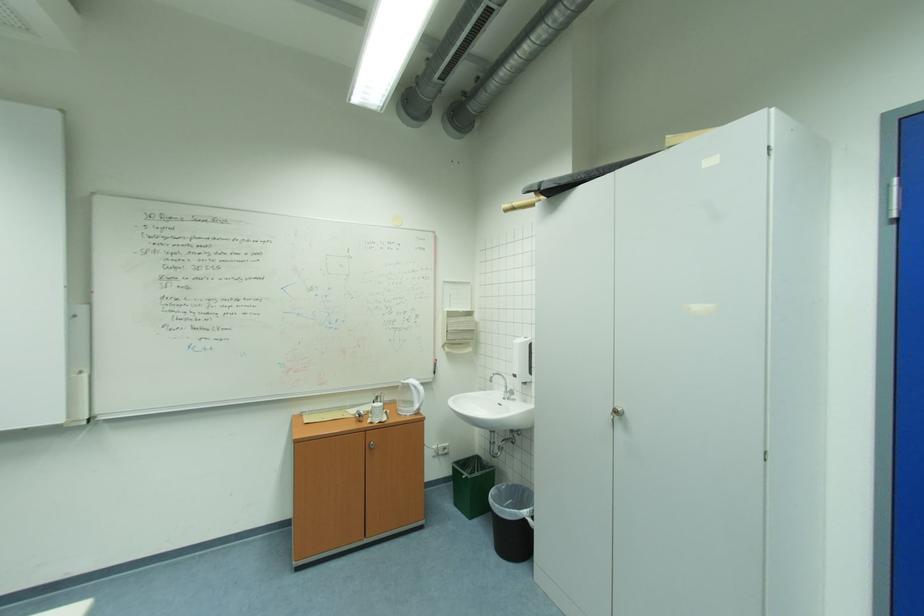
You are a GUI agent. You are given a task and a screenshot of the screen. Output one action in this format:
    pyautogui.click(x=<x>, y=<y>)
    Task: Click on the sink faucet handle
    
    Given the screenshot: What is the action you would take?
    pyautogui.click(x=502, y=384)